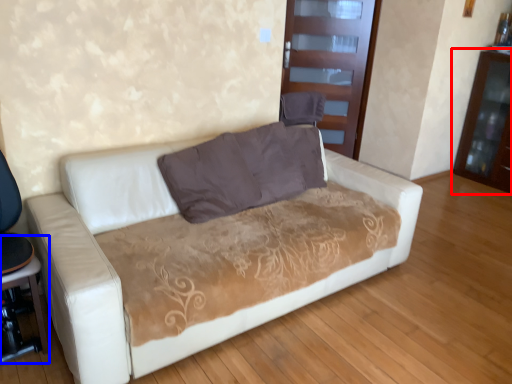
Question: Which object appears farthest to the camera in this image, dresser (highlighted by a red box) or table (highlighted by a blue box)?

Choices:
 (A) dresser
 (B) table

Answer: (A)